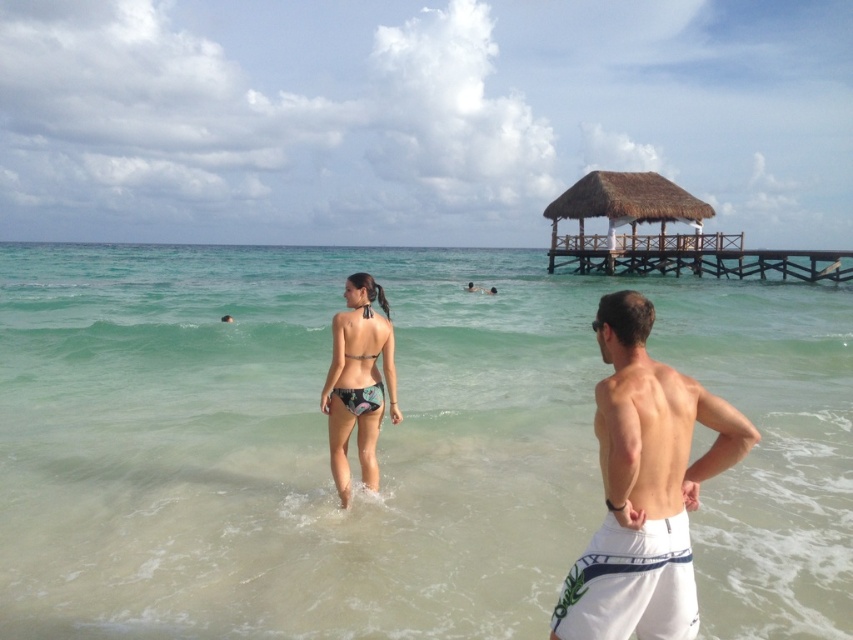
You are standing on the beach and want to walk towards the white textured shorts at right without getting your feet wet. Can you do so by walking around the clear water at center?

The clear water at center is closer to you than the white textured shorts at right, so you can walk around it to reach the white textured shorts at right without getting your feet wet.

You are a photographer trying to capture a closeup shot of the printed fabric bikini at center and floral print bikini at center. Since you want both bikinis to be clearly visible in the photo, which one should you focus on first?

You should focus on the printed fabric bikini at center first because it is larger in size compared to the floral print bikini at center, ensuring it is in clear focus before adjusting for the smaller one.

You are standing on the beach and want to walk from the clear water at center to the white textured shorts at right. Which direction should you move?

You should move to the right because the clear water at center is to the left of white textured shorts at right.